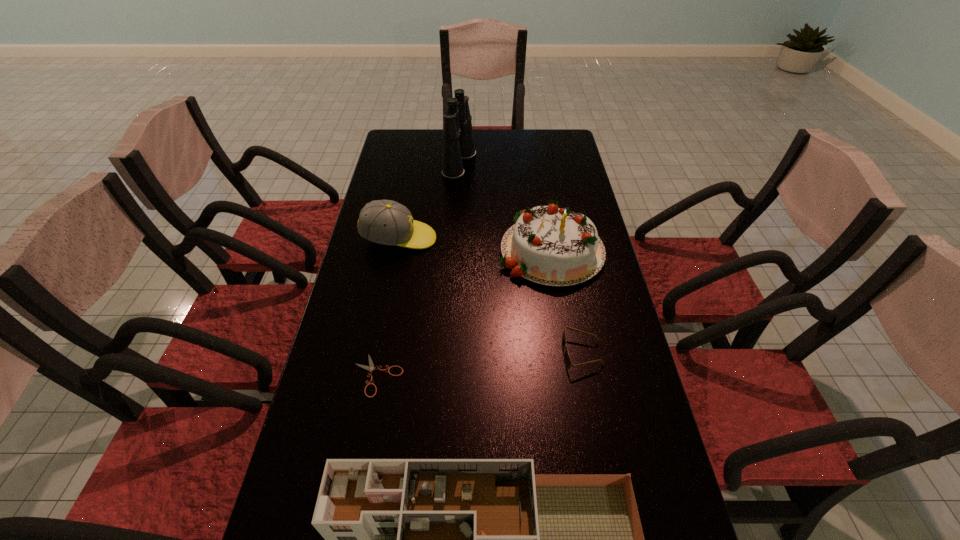
What are the coordinates of `binoculars` in the screenshot? It's located at (458, 142).

The image size is (960, 540). Find the location of `the farthest object`. the farthest object is located at coordinates (x=458, y=142).

Locate an element on the screen. The width and height of the screenshot is (960, 540). cake is located at coordinates (547, 245).

Image resolution: width=960 pixels, height=540 pixels. I want to click on baseball cap, so click(x=386, y=222).

Where is `the fifth tallest object`? the fifth tallest object is located at coordinates (567, 360).

Locate an element on the screen. The height and width of the screenshot is (540, 960). shears is located at coordinates (370, 368).

Find the location of a particular element. vacant region located on the front of the binoculars is located at coordinates (456, 228).

Where is `vacant space located on the front of the cake`? This screenshot has height=540, width=960. vacant space located on the front of the cake is located at coordinates (577, 409).

Where is `vacant space located 0.080m on the front-facing side of the baseball cap`? vacant space located 0.080m on the front-facing side of the baseball cap is located at coordinates click(462, 239).

You are a GUI agent. You are given a task and a screenshot of the screen. Output one action in this format:
    pyautogui.click(x=<x>, y=<y>)
    Task: Click on the vacant area situated on the frames of the sunglasses
    This screenshot has width=960, height=540.
    Given the screenshot: What is the action you would take?
    pyautogui.click(x=458, y=354)